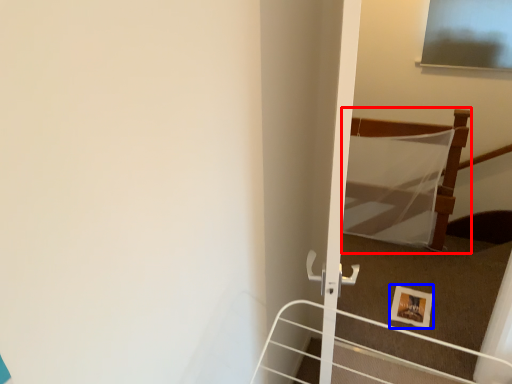
Question: Which object appears farthest to the camera in this image, bed (highlighted by a red box) or picture frame (highlighted by a blue box)?

Choices:
 (A) bed
 (B) picture frame

Answer: (A)